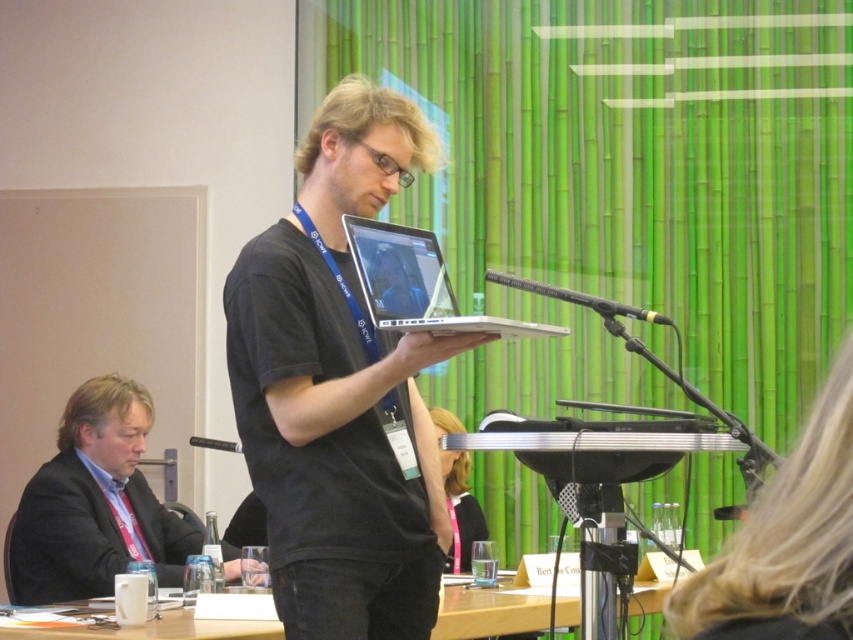
Question: From the image, what is the correct spatial relationship of black matte laptop at center in relation to wooden table at lower center?

Choices:
 (A) left
 (B) right

Answer: (A)

Question: Considering the relative positions of silver metallic laptop at center and black plastic microphone at center in the image provided, where is silver metallic laptop at center located with respect to black plastic microphone at center?

Choices:
 (A) below
 (B) above

Answer: (B)

Question: Which point is farther to the camera?

Choices:
 (A) blonde hair at upper right
 (B) black matte microphone at center
 (C) black matte laptop at center
 (D) matte black laptop at center

Answer: (D)

Question: Is wooden table at lower center above matte black laptop at center?

Choices:
 (A) yes
 (B) no

Answer: (B)

Question: Based on their relative distances, which object is nearer to the black matte microphone at center?

Choices:
 (A) matte black laptop at center
 (B) wooden table at lower center
 (C) blonde hair at upper right
 (D) dark suit at left

Answer: (C)

Question: Which of the following is the closest to the observer?

Choices:
 (A) (514, 278)
 (B) (41, 604)
 (C) (436, 250)

Answer: (A)